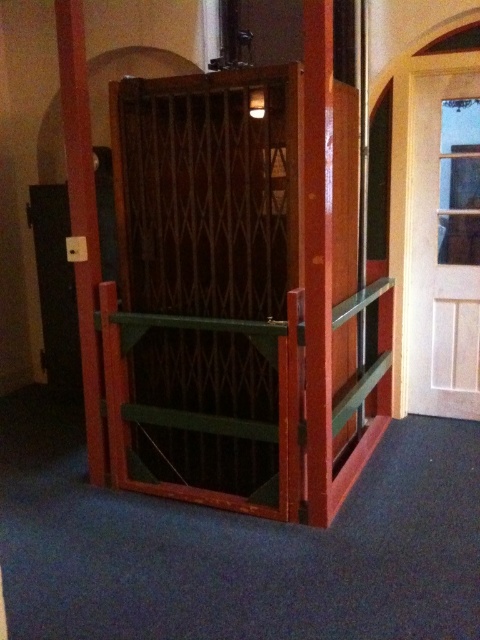
You are standing in a hallway and see the metallic silver elevator at center and the green wood balustrade at center. Which object is positioned to the left side of the hallway?

The metallic silver elevator at center is to the left of green wood balustrade at center, so the metallic silver elevator at center is positioned to the left side of the hallway.

You are standing in a hallway and see the metallic silver elevator at center and the white wooden door at upper right. Which object is taller?

The metallic silver elevator at center is taller than the white wooden door at upper right.

You are standing inside the elevator and want to reach the green wood balustrade at center. Which direction should you move to get closer to it compared to the wooden pole at left?

The green wood balustrade at center is below the wooden pole at left, so you should move downward to get closer to the green wood balustrade at center while moving away from the wooden pole at left.